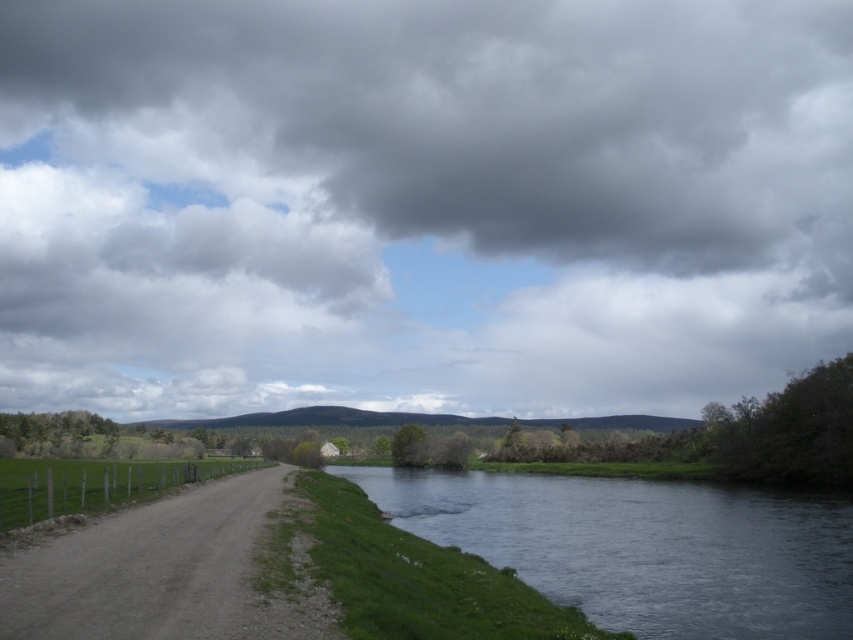
Question: Considering the real-world distances, which object is closest to the cloudy sky at upper center?

Choices:
 (A) dirt/gravel road at left
 (B) dark gray water at lower center

Answer: (B)

Question: Observing the image, what is the correct spatial positioning of dark gray water at lower center in reference to dirt/gravel road at left?

Choices:
 (A) below
 (B) above

Answer: (A)

Question: Estimate the real-world distances between objects in this image. Which object is closer to the cloudy sky at upper center?

Choices:
 (A) dirt/gravel road at left
 (B) dark gray water at lower center

Answer: (B)

Question: Is dark gray water at lower center positioned before dirt/gravel road at left?

Choices:
 (A) yes
 (B) no

Answer: (B)

Question: Does cloudy sky at upper center have a larger size compared to dark gray water at lower center?

Choices:
 (A) yes
 (B) no

Answer: (A)

Question: Which object appears closest to the camera in this image?

Choices:
 (A) dark gray water at lower center
 (B) dirt/gravel road at left
 (C) cloudy sky at upper center

Answer: (B)